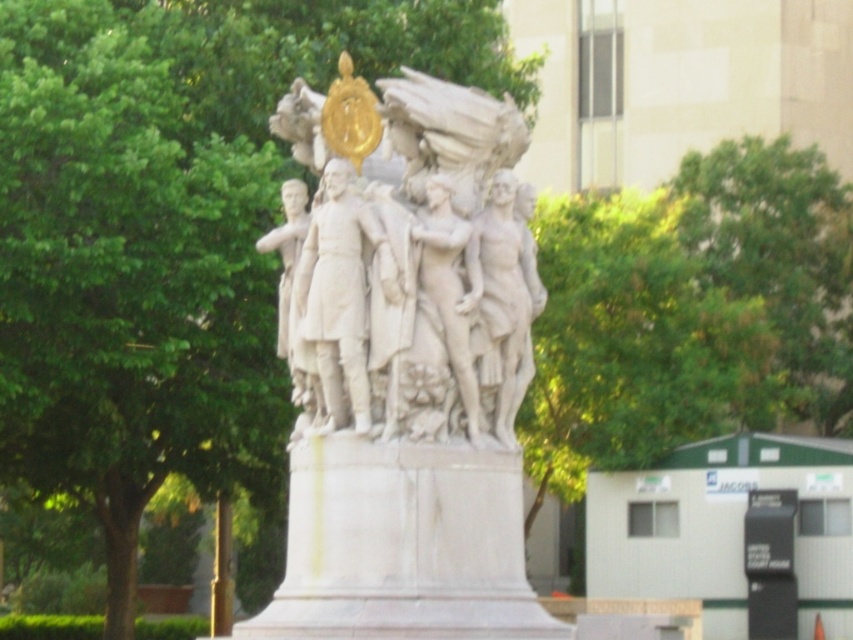
Is white marble statue at center to the left of green leafy tree at upper center from the viewer's perspective?

Indeed, white marble statue at center is positioned on the left side of green leafy tree at upper center.

Consider the image. Can you confirm if white marble statue at center is wider than green leafy tree at upper center?

No, white marble statue at center is not wider than green leafy tree at upper center.

Is point (358, 193) less distant than point (741, 195)?

Yes, it is in front of point (741, 195).

The height and width of the screenshot is (640, 853). I want to click on white marble statue at center, so click(x=407, y=368).